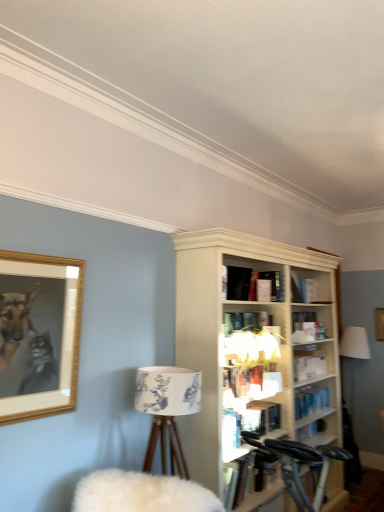
Question: From the image's perspective, is matte black book at upper center, which is the 1th book in top-to-bottom order, above or below white fabric lampshade at upper center?

Choices:
 (A) above
 (B) below

Answer: (A)

Question: Is matte black book at upper center, the 2th book from the bottom, to the left or to the right of white fabric lampshade at upper center in the image?

Choices:
 (A) left
 (B) right

Answer: (B)

Question: Based on their relative distances, which object is nearer to the matte black book at upper center, the 2th book from the bottom?

Choices:
 (A) metallic silver bicycle at lower right
 (B) white fluffy swivel chair at lower left
 (C) wooden picture frame at upper left
 (D) hardcover book at center, arranged as the 2th book when viewed from the top
 (E) white fabric lampshade at lower right

Answer: (D)

Question: Estimate the real-world distances between objects in this image. Which object is farther from the wooden picture frame at upper left?

Choices:
 (A) hardcover book at center, the 1th book ordered from the bottom
 (B) white fabric lampshade at upper center
 (C) metallic silver bicycle at lower right
 (D) matte black book at upper center, the 2th book from the bottom
 (E) white fluffy swivel chair at lower left

Answer: (C)